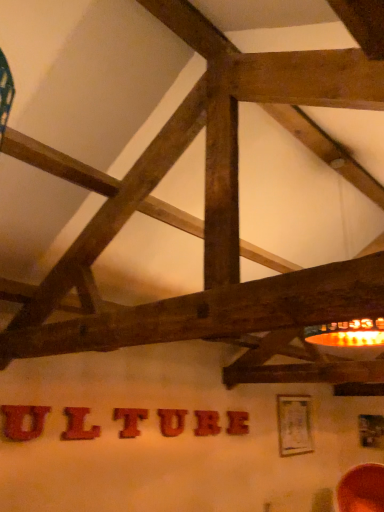
Locate an element on the screen. wooden letter at center, which ranks as the 1th letter in right-to-left order is located at coordinates (237, 423).

Measure the distance between wooden letter at center, which ranks as the 1th letter in right-to-left order, and camera.

wooden letter at center, which ranks as the 1th letter in right-to-left order, is 4.59 meters from camera.

The height and width of the screenshot is (512, 384). Describe the element at coordinates (23, 421) in the screenshot. I see `brushed wood letter at center, which appears as the 1th letter when viewed from the left` at that location.

What do you see at coordinates (78, 425) in the screenshot? I see `matte red letter at center, marked as the second letter in a left-to-right arrangement` at bounding box center [78, 425].

Measure the distance between point (197, 413) and camera.

The distance of point (197, 413) from camera is 14.08 feet.

What do you see at coordinates (172, 421) in the screenshot? Image resolution: width=384 pixels, height=512 pixels. I see `wooden letter at center, the 3th letter in the right-to-left sequence` at bounding box center [172, 421].

Identify the location of wooden letter at center, which is the sixth letter in front-to-back order. (237, 423).

Which object is more forward, matte red letter at center, the 2th letter from the front, or wooden letter at center, the second letter in the right-to-left sequence?

Positioned in front is matte red letter at center, the 2th letter from the front.

Which point is more distant from viewer, (71, 437) or (196, 426)?

Positioned behind is point (196, 426).

Could you tell me if matte red letter at center, marked as the second letter in a left-to-right arrangement, is facing wooden letter at center, arranged as the second letter when viewed from the back?

No.

Is wooden letter at center, the fifth letter when ordered from left to right, inside wooden letter at center, which is the sixth letter in front-to-back order?

No.

From the image's perspective, would you say wooden letter at center, which ranks as the 1th letter in right-to-left order, is shown under wooden letter at center, acting as the fifth letter starting from the front?

Yes.

Consider the image. Can you confirm if wooden letter at center, which is the sixth letter in left-to-right order, is taller than wooden letter at center, the second letter in the right-to-left sequence?

Incorrect, the height of wooden letter at center, which is the sixth letter in left-to-right order, is not larger of that of wooden letter at center, the second letter in the right-to-left sequence.

Can we say brushed wood letter at center, which is the 6th letter from back to front, lies outside wooden letter at center, acting as the fifth letter starting from the front?

Yes, brushed wood letter at center, which is the 6th letter from back to front, is located beyond the bounds of wooden letter at center, acting as the fifth letter starting from the front.

From a real-world perspective, is brushed wood letter at center, which appears as the 1th letter when viewed from the left, located beneath wooden letter at center, arranged as the second letter when viewed from the back?

Yes, from a real-world perspective, brushed wood letter at center, which appears as the 1th letter when viewed from the left, is under wooden letter at center, arranged as the second letter when viewed from the back.

Is brushed wood letter at center, which is the 6th letter from back to front, facing away from wooden letter at center, arranged as the second letter when viewed from the back?

No.

Can you confirm if brushed wood letter at center, which is the 6th letter from back to front, is thinner than wooden letter at center, acting as the fifth letter starting from the front?

Yes.

From the image's perspective, is wooden letter at center, positioned as the fourth letter in front-to-back order, beneath brushed wood letter at center, which is counted as the 6th letter, starting from the right?

Correct, wooden letter at center, positioned as the fourth letter in front-to-back order, appears lower than brushed wood letter at center, which is counted as the 6th letter, starting from the right, in the image.

Can you tell me how much wooden letter at center, placed as the 4th letter when sorted from left to right, and brushed wood letter at center, which is the 6th letter from back to front, differ in facing direction?

They differ by 0.027 degrees in their facing directions.

Is wooden letter at center, positioned as the fourth letter in front-to-back order, oriented towards brushed wood letter at center, marked as the 1th letter in a front-to-back arrangement?

No, wooden letter at center, positioned as the fourth letter in front-to-back order, is not aimed at brushed wood letter at center, marked as the 1th letter in a front-to-back arrangement.

Is wooden letter at center, the third letter when ordered from back to front, wider than brushed wood letter at center, which is counted as the 6th letter, starting from the right?

Correct, the width of wooden letter at center, the third letter when ordered from back to front, exceeds that of brushed wood letter at center, which is counted as the 6th letter, starting from the right.

From a real-world perspective, which letter is the 1st one underneath the wooden letter at center, the second letter in the right-to-left sequence? Please provide its 2D coordinates.

[(172, 421)]

Between point (172, 433) and point (217, 428), which one is positioned behind?

The point (217, 428) is behind.

Measure the distance from wooden letter at center, the third letter when ordered from back to front, to wooden letter at center, acting as the fifth letter starting from the front.

The distance of wooden letter at center, the third letter when ordered from back to front, from wooden letter at center, acting as the fifth letter starting from the front, is 34.59 centimeters.

Is white paper at center to the right of wooden letter t at center, the 3th letter viewed from the left, from the viewer's perspective?

Correct, you'll find white paper at center to the right of wooden letter t at center, the 3th letter viewed from the left.

Is white paper at center facing towards wooden letter t at center, which ranks as the fourth letter in right-to-left order?

No, white paper at center is not aimed at wooden letter t at center, which ranks as the fourth letter in right-to-left order.

Is point (300, 421) closer to viewer compared to point (131, 425)?

No, it is behind (131, 425).

Which of these two, white paper at center or wooden letter at center, the fifth letter when ordered from left to right, is wider?

With larger width is white paper at center.

Identify the location of picture frame on the right of the wooden letter at center, arranged as the second letter when viewed from the back. (294, 425).

Considering the positions of point (286, 419) and point (204, 433), is point (286, 419) closer or farther from the camera than point (204, 433)?

Clearly, point (286, 419) is more distant from the camera than point (204, 433).

From the image's perspective, is white paper at center positioned above or below wooden letter at center, the second letter in the right-to-left sequence?

white paper at center is situated lower than wooden letter at center, the second letter in the right-to-left sequence, in the image.

You are a GUI agent. You are given a task and a screenshot of the screen. Output one action in this format:
    pyautogui.click(x=<x>, y=<y>)
    Task: Click on the 3rd letter to the right when counting from the matte red letter at center, marked as the fifth letter in a right-to-left arrangement
    The image size is (384, 512).
    Given the screenshot: What is the action you would take?
    pyautogui.click(x=206, y=423)

Locate an element on the screen. The image size is (384, 512). letter that is the 1st one when counting leftward from the wooden letter at center, which is the sixth letter in front-to-back order is located at coordinates (206, 423).

Considering their positions, is wooden letter at center, the 1th letter in the back-to-front sequence, positioned closer to wooden letter at center, the second letter in the right-to-left sequence, than wooden letter at center, the 3th letter in the right-to-left sequence?

Among the two, wooden letter at center, the 1th letter in the back-to-front sequence, is located nearer to wooden letter at center, the second letter in the right-to-left sequence.

Looking at the image, which one is located further to matte red letter at center, marked as the second letter in a left-to-right arrangement, white paper at center or wooden letter t at center, which is the third letter from front to back?

white paper at center is further to matte red letter at center, marked as the second letter in a left-to-right arrangement.

Which object lies further to the anchor point wooden letter at center, the third letter when ordered from back to front, wooden letter t at center, which is the third letter from front to back, or white paper at center?

The object further to wooden letter at center, the third letter when ordered from back to front, is white paper at center.

Looking at the image, which one is located closer to wooden letter at center, which ranks as the 1th letter in right-to-left order, matte red letter at center, the 2th letter from the front, or wooden letter at center, the fifth letter when ordered from left to right?

Among the two, wooden letter at center, the fifth letter when ordered from left to right, is located nearer to wooden letter at center, which ranks as the 1th letter in right-to-left order.

Estimate the real-world distances between objects in this image. Which object is closer to white paper at center, wooden letter t at center, marked as the 4th letter in a back-to-front arrangement, or wooden letter at center, placed as the 4th letter when sorted from left to right?

wooden letter at center, placed as the 4th letter when sorted from left to right, is closer to white paper at center.

Estimate the real-world distances between objects in this image. Which object is closer to brushed wood letter at center, which is the 6th letter from back to front, wooden letter at center, which ranks as the 1th letter in right-to-left order, or wooden letter at center, acting as the fifth letter starting from the front?

wooden letter at center, acting as the fifth letter starting from the front, is closer to brushed wood letter at center, which is the 6th letter from back to front.

From the image, which object appears to be farther from brushed wood letter at center, which is the 6th letter from back to front, wooden letter at center, placed as the 4th letter when sorted from left to right, or wooden letter at center, the second letter in the right-to-left sequence?

wooden letter at center, the second letter in the right-to-left sequence, is further to brushed wood letter at center, which is the 6th letter from back to front.

Considering their positions, is wooden letter at center, acting as the fifth letter starting from the front, positioned further to white paper at center than brushed wood letter at center, marked as the 1th letter in a front-to-back arrangement?

Based on the image, brushed wood letter at center, marked as the 1th letter in a front-to-back arrangement, appears to be further to white paper at center.

Where is `letter between wooden letter at center, the 3th letter in the right-to-left sequence, and wooden letter at center, the 1th letter in the back-to-front sequence, in the horizontal direction`? Image resolution: width=384 pixels, height=512 pixels. letter between wooden letter at center, the 3th letter in the right-to-left sequence, and wooden letter at center, the 1th letter in the back-to-front sequence, in the horizontal direction is located at coordinates (206, 423).

You are a GUI agent. You are given a task and a screenshot of the screen. Output one action in this format:
    pyautogui.click(x=<x>, y=<y>)
    Task: Click on the letter between brushed wood letter at center, which is counted as the 6th letter, starting from the right, and wooden letter t at center, the 3th letter viewed from the left
    This screenshot has width=384, height=512.
    Given the screenshot: What is the action you would take?
    pyautogui.click(x=78, y=425)

Locate an element on the screen. Image resolution: width=384 pixels, height=512 pixels. letter between wooden letter t at center, the 3th letter viewed from the left, and wooden letter at center, the fifth letter when ordered from left to right, from left to right is located at coordinates (172, 421).

This screenshot has height=512, width=384. I want to click on letter situated between wooden letter at center, arranged as the second letter when viewed from the back, and white paper at center from left to right, so click(237, 423).